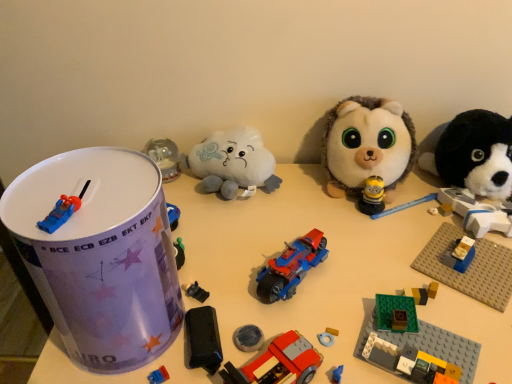
This screenshot has width=512, height=384. Identify the location of vacant space in between white plush cloud at center, which appears as the seventh toy when viewed from the right, and green plastic building block at lower right, the third toy from the right. (282, 248).